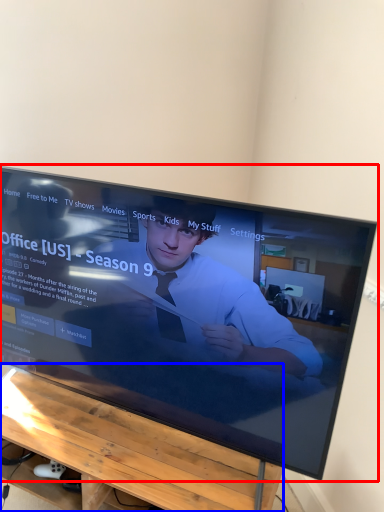
Question: Which point is further to the camera, television (highlighted by a red box) or furniture (highlighted by a blue box)?

Choices:
 (A) television
 (B) furniture

Answer: (B)